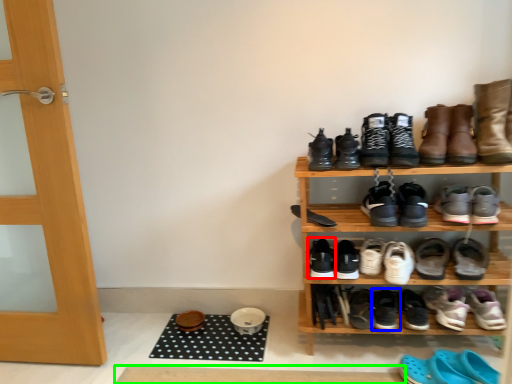
Question: Which object is positioned closest to footwear (highlighted by a red box)? Select from footwear (highlighted by a blue box) and doormat (highlighted by a green box).

Choices:
 (A) footwear
 (B) doormat

Answer: (A)